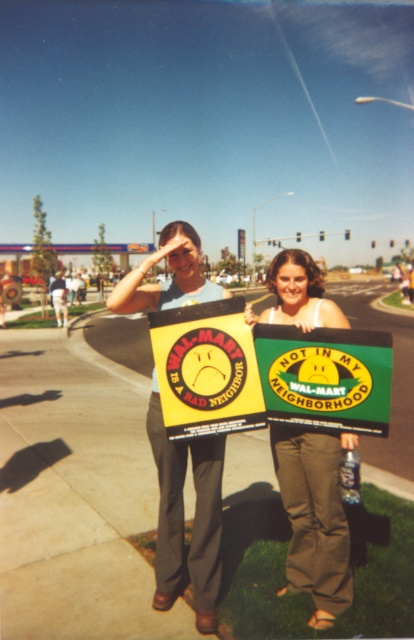
You are a photographer trying to capture both the green fabric sign at center and the yellow matte sign at center in a single frame. Given that your camera has a fixed width, which sign should you position closer to the camera to ensure both signs appear equally wide in the photo?

To make both signs appear equally wide in the photo, position the green fabric sign at center closer to the camera since its actual width is greater than the yellow matte sign at center. This adjustment compensates for the size difference, ensuring they appear similar in the frame.

You are a photographer trying to capture a clear photo of both the green fabric sign at center and the yellow matte sign at center. Which sign should you focus on first to ensure it appears sharp in the photo?

You should focus on the green fabric sign at center first because it is closer to you than the yellow matte sign at center, ensuring it stays sharp in the photo.

You are a photographer trying to capture a photo of both protesters holding their signs. You want to ensure that both protesters are fully visible in the frame. Given their positions at point coordinates point (296, 497) and point (317, 394), which protester should you position closer to the camera to avoid one blocking the other?

Point (296, 497) is behind point (317, 394), so to ensure both protesters are fully visible, you should position the protester at point (317, 394) closer to the camera.